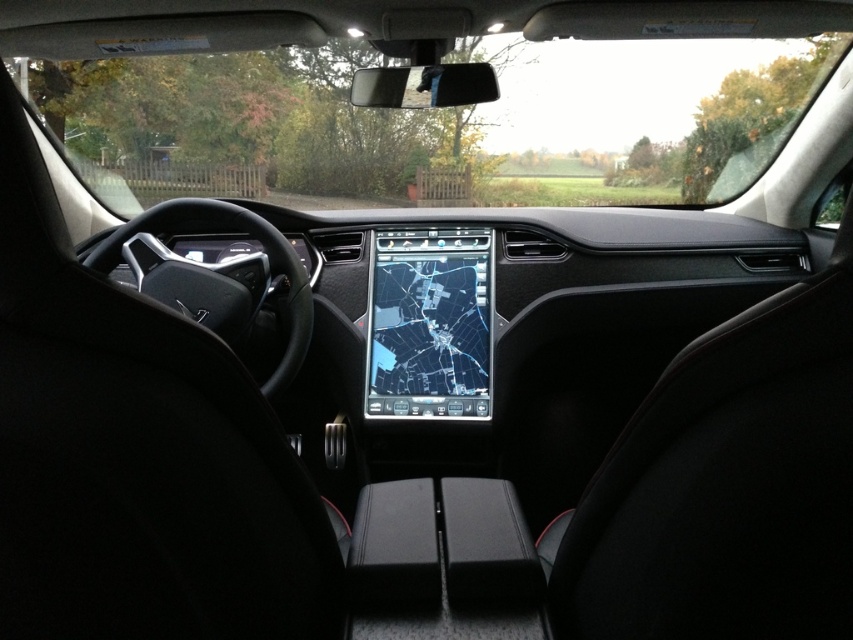
Based on the photo, you are a passenger in the car and want to look at the road ahead through the transparent glass windshield at upper center while also checking the shiny black touchscreen at center for directions. Can you see both the windshield and the touchscreen at the same time without moving your head?

The transparent glass windshield at upper center is above the shiny black touchscreen at center, so you can see both at the same time by looking up to the windshield and down to the touchscreen without moving your head.